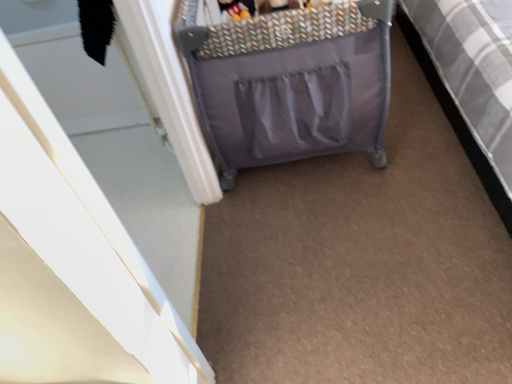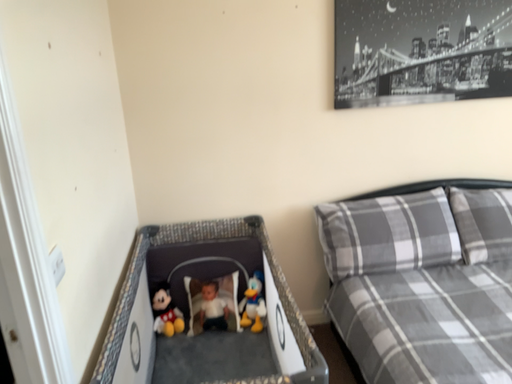
Question: How did the camera likely rotate when shooting the video?

Choices:
 (A) rotated left
 (B) rotated right

Answer: (B)